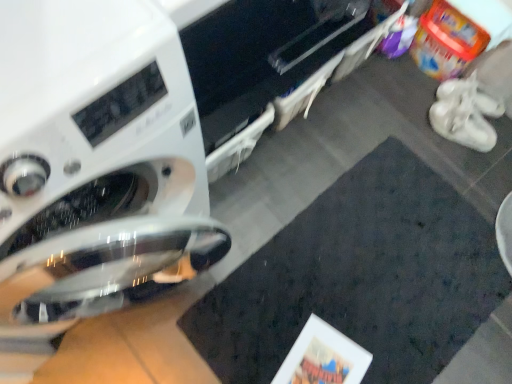
This screenshot has height=384, width=512. Find the location of `unoccupied space behind dark matte mat at center`. unoccupied space behind dark matte mat at center is located at coordinates (367, 145).